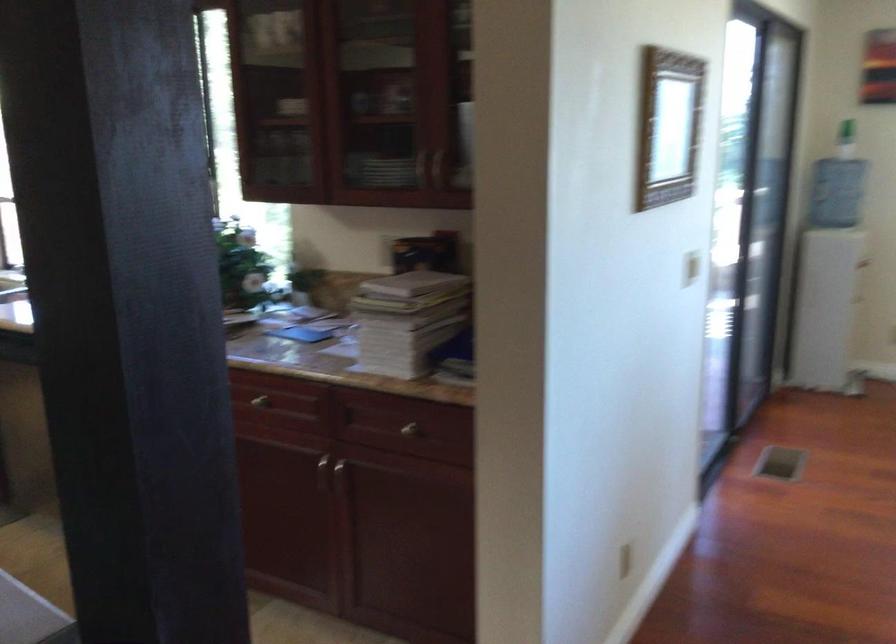
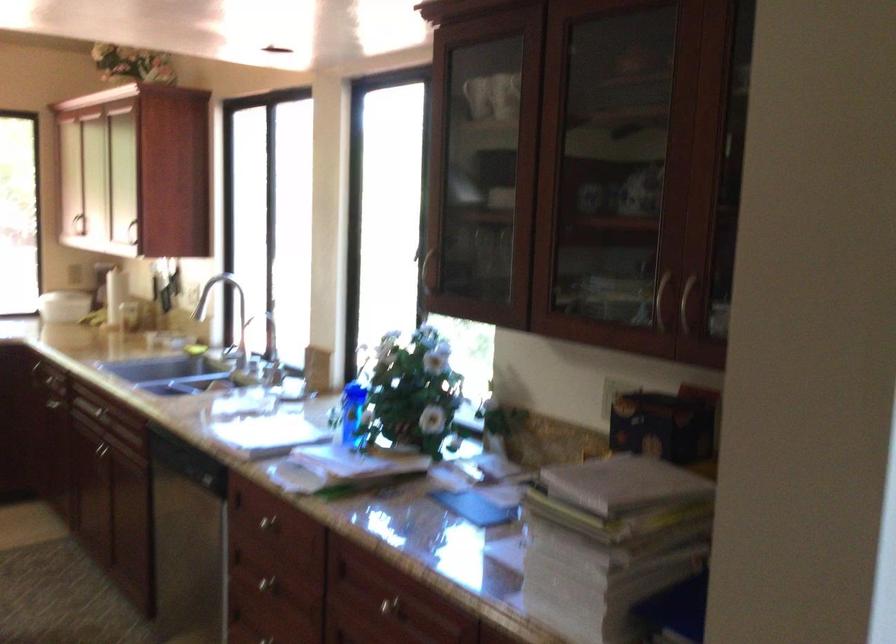
The point at (384, 241) is marked in the first image. Where is the corresponding point in the second image?

(614, 393)